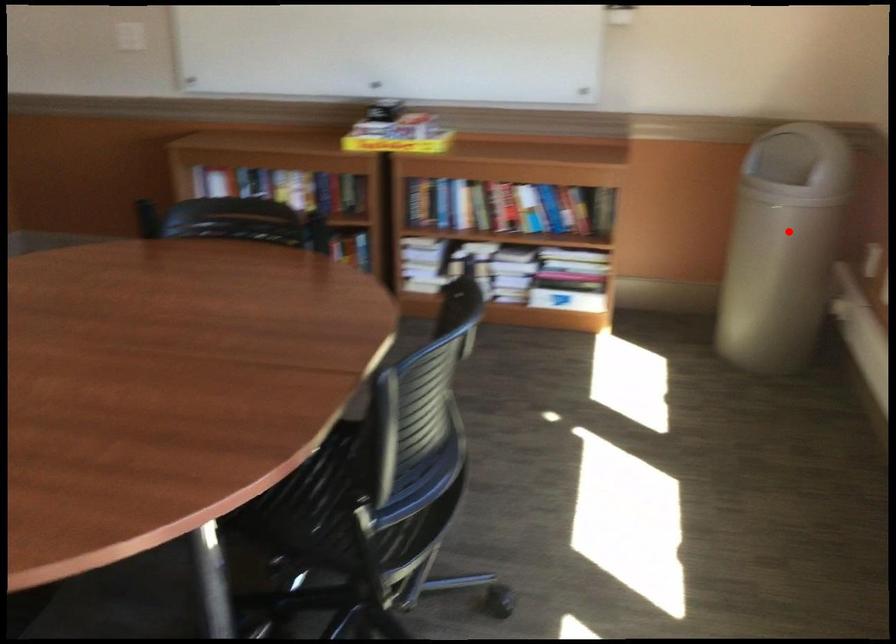
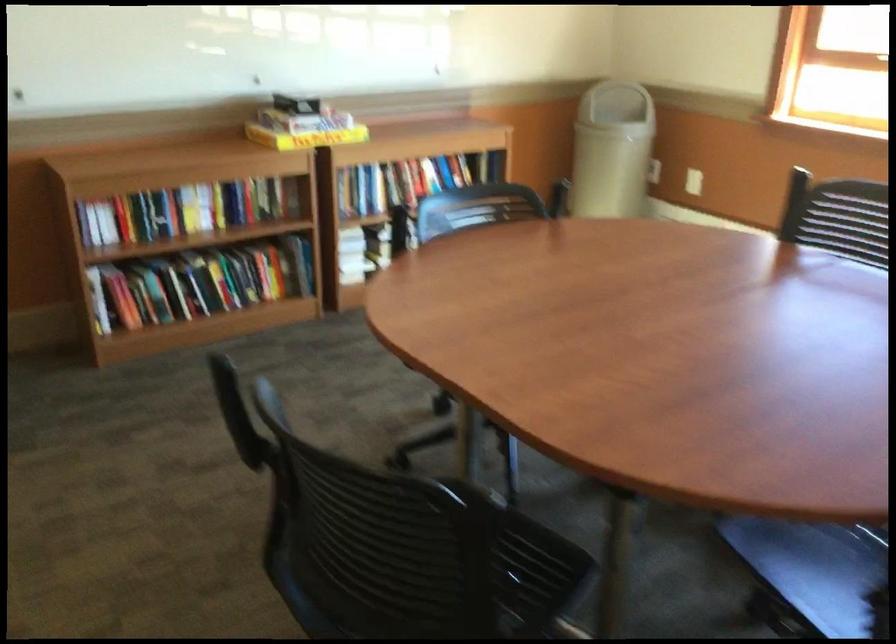
Question: A red point is marked in image1. In image2, is the corresponding 3D point closer to the camera or farther? Reply with the corresponding letter.

Choices:
 (A) The corresponding 3D point is closer.
 (B) The corresponding 3D point is farther.

Answer: (B)